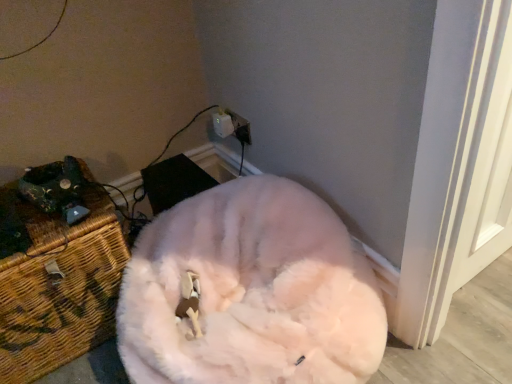
Question: Can you see white plastic electric outlet at upper center touching woven wicker chest at left?

Choices:
 (A) yes
 (B) no

Answer: (B)

Question: Is white plastic electric outlet at upper center smaller than woven wicker chest at left?

Choices:
 (A) yes
 (B) no

Answer: (A)

Question: Is the position of white plastic electric outlet at upper center more distant than that of woven wicker chest at left?

Choices:
 (A) yes
 (B) no

Answer: (A)

Question: From the image's perspective, does white plastic electric outlet at upper center appear lower than woven wicker chest at left?

Choices:
 (A) yes
 (B) no

Answer: (B)

Question: Is white plastic electric outlet at upper center thinner than woven wicker chest at left?

Choices:
 (A) no
 (B) yes

Answer: (B)

Question: Is white plastic electric outlet at upper center turned away from woven wicker chest at left?

Choices:
 (A) yes
 (B) no

Answer: (B)

Question: Is white fluffy cat at center positioned before woven wicker chest at left?

Choices:
 (A) yes
 (B) no

Answer: (A)

Question: Can we say white fluffy cat at center lies outside woven wicker chest at left?

Choices:
 (A) yes
 (B) no

Answer: (A)

Question: From the image's perspective, does white fluffy cat at center appear higher than woven wicker chest at left?

Choices:
 (A) yes
 (B) no

Answer: (B)

Question: Is there a large distance between white fluffy cat at center and woven wicker chest at left?

Choices:
 (A) no
 (B) yes

Answer: (A)

Question: Considering the relative sizes of white fluffy cat at center and woven wicker chest at left in the image provided, is white fluffy cat at center wider than woven wicker chest at left?

Choices:
 (A) yes
 (B) no

Answer: (A)

Question: From the image's perspective, is white fluffy cat at center located beneath woven wicker chest at left?

Choices:
 (A) no
 (B) yes

Answer: (B)

Question: Can you confirm if woven wicker chest at left is shorter than white fluffy cat at center?

Choices:
 (A) yes
 (B) no

Answer: (B)